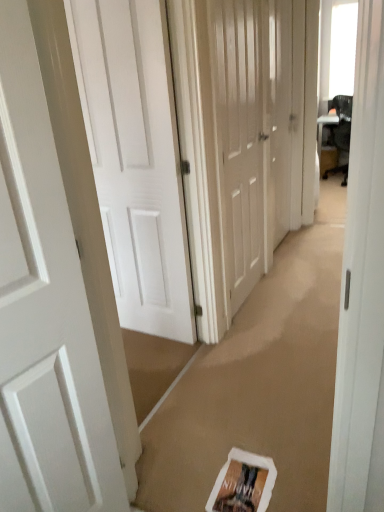
The image size is (384, 512). I want to click on white matte door at center, which is the 3th door in right-to-left order, so click(135, 159).

Which is more to the right, white matte door at left, the fourth door positioned from the right, or white matte door at center, positioned as the 3th door in left-to-right order?

From the viewer's perspective, white matte door at center, positioned as the 3th door in left-to-right order, appears more on the right side.

From the image's perspective, starting from the white matte door at center, placed as the second door when sorted from right to left, which door is the 2nd one below? Please provide its 2D coordinates.

[(44, 312)]

Considering the sizes of white matte door at left, the fourth door positioned from the right, and white matte door at center, positioned as the 3th door in left-to-right order, in the image, is white matte door at left, the fourth door positioned from the right, bigger or smaller than white matte door at center, positioned as the 3th door in left-to-right order,?

white matte door at left, the fourth door positioned from the right, is smaller than white matte door at center, positioned as the 3th door in left-to-right order.

Consider the image. Is white matte door at center, which is the 3th door in right-to-left order, surrounding white glossy door at center, positioned as the 1th door in right-to-left order?

No, white glossy door at center, positioned as the 1th door in right-to-left order, is not surrounded by white matte door at center, which is the 3th door in right-to-left order.

Is white matte door at center, arranged as the 2th door when viewed from the left, far from white glossy door at center, acting as the fourth door starting from the left?

Yes, white matte door at center, arranged as the 2th door when viewed from the left, and white glossy door at center, acting as the fourth door starting from the left, are quite far apart.

How different are the orientations of white matte door at center, arranged as the 2th door when viewed from the left, and white glossy door at center, acting as the fourth door starting from the left, in degrees?

white matte door at center, arranged as the 2th door when viewed from the left, and white glossy door at center, acting as the fourth door starting from the left, are facing 0.524 degrees away from each other.

Which of these two, white matte door at center, arranged as the 2th door when viewed from the left, or white glossy door at center, acting as the fourth door starting from the left, is bigger?

white matte door at center, arranged as the 2th door when viewed from the left.

Is white matte door at center, positioned as the 3th door in left-to-right order, taller than white matte door at left, the fourth door positioned from the right?

Yes.

Which point is more forward, (260, 69) or (71, 326)?

Positioned in front is point (71, 326).

From the image's perspective, which one is positioned higher, white matte door at center, positioned as the 3th door in left-to-right order, or white matte door at left, the fourth door positioned from the right?

white matte door at center, positioned as the 3th door in left-to-right order, appears higher in the image.

Considering the relative positions of white matte door at center, positioned as the 3th door in left-to-right order, and white matte door at left, positioned as the first door in left-to-right order, in the image provided, is white matte door at center, positioned as the 3th door in left-to-right order, in front of white matte door at left, positioned as the first door in left-to-right order,?

No, it is not.

Can you confirm if white glossy door at center, acting as the fourth door starting from the left, is bigger than white matte door at left, the fourth door positioned from the right?

Yes, white glossy door at center, acting as the fourth door starting from the left, is bigger than white matte door at left, the fourth door positioned from the right.

Which point is more distant from viewer, (x=287, y=124) or (x=68, y=230)?

Point (x=287, y=124)

From their relative heights in the image, would you say white glossy door at center, positioned as the 1th door in right-to-left order, is taller or shorter than white matte door at left, the fourth door positioned from the right?

In the image, white glossy door at center, positioned as the 1th door in right-to-left order, appears to be taller than white matte door at left, the fourth door positioned from the right.

Is white glossy door at center, positioned as the 1th door in right-to-left order, surrounding white matte door at left, positioned as the first door in left-to-right order?

No, white matte door at left, positioned as the first door in left-to-right order, is located outside of white glossy door at center, positioned as the 1th door in right-to-left order.

Based on their positions, is white matte door at left, positioned as the first door in left-to-right order, located to the left or right of white matte door at center, arranged as the 2th door when viewed from the left?

From the image, it's evident that white matte door at left, positioned as the first door in left-to-right order, is to the left of white matte door at center, arranged as the 2th door when viewed from the left.

Is white matte door at left, positioned as the first door in left-to-right order, oriented towards white matte door at center, arranged as the 2th door when viewed from the left?

No, white matte door at left, positioned as the first door in left-to-right order, is not facing towards white matte door at center, arranged as the 2th door when viewed from the left.

Which object is closer to the camera taking this photo, white matte door at left, the fourth door positioned from the right, or white matte door at center, which is the 3th door in right-to-left order?

white matte door at left, the fourth door positioned from the right, is in front.

In the scene shown: Considering the relative sizes of white matte door at left, the fourth door positioned from the right, and white matte door at center, which is the 3th door in right-to-left order, in the image provided, is white matte door at left, the fourth door positioned from the right, shorter than white matte door at center, which is the 3th door in right-to-left order,?

Correct, white matte door at left, the fourth door positioned from the right, is not as tall as white matte door at center, which is the 3th door in right-to-left order.

Is white matte door at center, which is the 3th door in right-to-left order, inside or outside of white matte door at left, positioned as the first door in left-to-right order?

white matte door at center, which is the 3th door in right-to-left order, exists outside the volume of white matte door at left, positioned as the first door in left-to-right order.

Looking at the image, does white matte door at center, arranged as the 2th door when viewed from the left, seem bigger or smaller compared to white matte door at left, positioned as the first door in left-to-right order?

white matte door at center, arranged as the 2th door when viewed from the left, is bigger than white matte door at left, positioned as the first door in left-to-right order.

Is white matte door at center, arranged as the 2th door when viewed from the left, taller than white matte door at left, positioned as the first door in left-to-right order?

Correct, white matte door at center, arranged as the 2th door when viewed from the left, is much taller as white matte door at left, positioned as the first door in left-to-right order.

Is white glossy door at center, acting as the fourth door starting from the left, oriented towards white matte door at center, arranged as the 2th door when viewed from the left?

No, white glossy door at center, acting as the fourth door starting from the left, is not turned towards white matte door at center, arranged as the 2th door when viewed from the left.

Which is correct: white glossy door at center, acting as the fourth door starting from the left, is inside white matte door at center, arranged as the 2th door when viewed from the left, or outside of it?

white glossy door at center, acting as the fourth door starting from the left, exists outside the volume of white matte door at center, arranged as the 2th door when viewed from the left.

Is white glossy door at center, positioned as the 1th door in right-to-left order, taller or shorter than white matte door at center, arranged as the 2th door when viewed from the left?

Clearly, white glossy door at center, positioned as the 1th door in right-to-left order, is taller compared to white matte door at center, arranged as the 2th door when viewed from the left.

This screenshot has width=384, height=512. Identify the location of the 2nd door in front of the white matte door at center, positioned as the 3th door in left-to-right order. (44, 312).

Which door is the 2nd one when counting from the right side of the white matte door at center, which is the 3th door in right-to-left order? Please provide its 2D coordinates.

[(280, 114)]

Considering their positions, is white matte door at left, positioned as the first door in left-to-right order, positioned closer to white matte door at center, arranged as the 2th door when viewed from the left, than white matte door at center, placed as the second door when sorted from right to left?

The object closer to white matte door at center, arranged as the 2th door when viewed from the left, is white matte door at center, placed as the second door when sorted from right to left.

From the image, which object appears to be nearer to white matte door at left, positioned as the first door in left-to-right order, white matte door at center, which is the 3th door in right-to-left order, or white matte door at center, positioned as the 3th door in left-to-right order?

The object closer to white matte door at left, positioned as the first door in left-to-right order, is white matte door at center, which is the 3th door in right-to-left order.

From the image, which object appears to be nearer to white matte door at center, placed as the second door when sorted from right to left, white matte door at left, the fourth door positioned from the right, or white glossy door at center, positioned as the 1th door in right-to-left order?

The object closer to white matte door at center, placed as the second door when sorted from right to left, is white glossy door at center, positioned as the 1th door in right-to-left order.

Which object lies nearer to the anchor point white matte door at center, placed as the second door when sorted from right to left, white matte door at center, arranged as the 2th door when viewed from the left, or white matte door at left, positioned as the first door in left-to-right order?

white matte door at center, arranged as the 2th door when viewed from the left, lies closer to white matte door at center, placed as the second door when sorted from right to left, than the other object.

Which object lies nearer to the anchor point white matte door at left, positioned as the first door in left-to-right order, white matte door at center, positioned as the 3th door in left-to-right order, or white glossy door at center, acting as the fourth door starting from the left?

white matte door at center, positioned as the 3th door in left-to-right order, is positioned closer to the anchor white matte door at left, positioned as the first door in left-to-right order.

From the image, which object appears to be farther from white matte door at center, arranged as the 2th door when viewed from the left, white glossy door at center, positioned as the 1th door in right-to-left order, or white matte door at left, the fourth door positioned from the right?

white glossy door at center, positioned as the 1th door in right-to-left order, is positioned further to the anchor white matte door at center, arranged as the 2th door when viewed from the left.

Based on their spatial positions, is white glossy door at center, positioned as the 1th door in right-to-left order, or white matte door at center, positioned as the 3th door in left-to-right order, further from white matte door at center, which is the 3th door in right-to-left order?

Based on the image, white glossy door at center, positioned as the 1th door in right-to-left order, appears to be further to white matte door at center, which is the 3th door in right-to-left order.

From the image, which object appears to be farther from white matte door at center, placed as the second door when sorted from right to left, white matte door at left, positioned as the first door in left-to-right order, or white matte door at center, arranged as the 2th door when viewed from the left?

white matte door at left, positioned as the first door in left-to-right order.

Identify the location of door between white matte door at center, which is the 3th door in right-to-left order, and white glossy door at center, acting as the fourth door starting from the left, in the front-back direction. Image resolution: width=384 pixels, height=512 pixels. (240, 139).

Image resolution: width=384 pixels, height=512 pixels. In order to click on door located between white matte door at left, positioned as the first door in left-to-right order, and white matte door at center, placed as the second door when sorted from right to left, in the depth direction in this screenshot , I will do `click(135, 159)`.